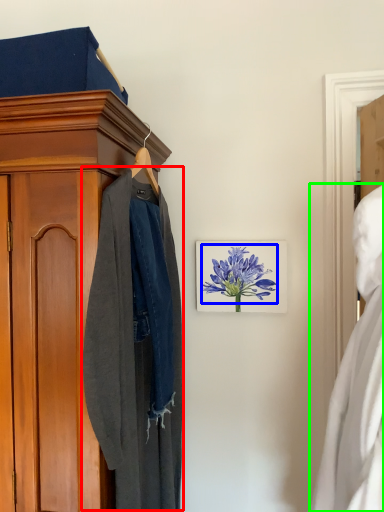
Question: Estimate the real-world distances between objects in this image. Which object is closer to clothing (highlighted by a red box), flower (highlighted by a blue box) or dress (highlighted by a green box)?

Choices:
 (A) flower
 (B) dress

Answer: (A)